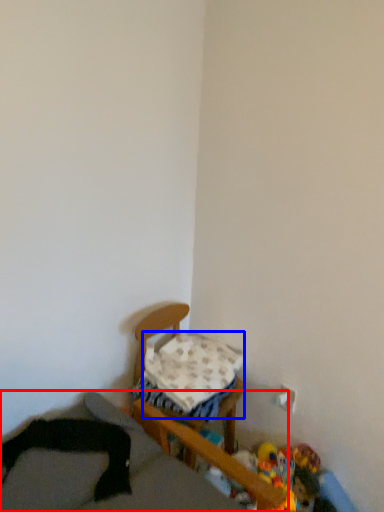
Question: Which of the following is the closest to the observer, furniture (highlighted by a red box) or pillow (highlighted by a blue box)?

Choices:
 (A) furniture
 (B) pillow

Answer: (A)